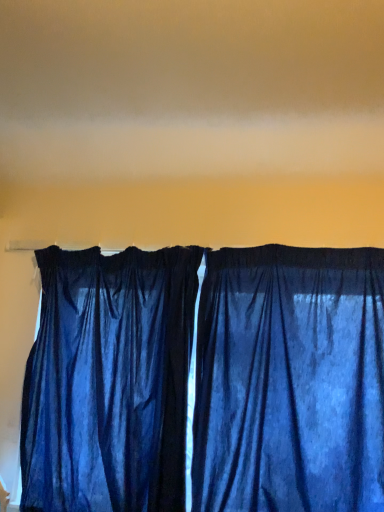
What is the approximate width of velvet blue curtains at center?

velvet blue curtains at center is 2.00 inches wide.

This screenshot has height=512, width=384. What do you see at coordinates (290, 381) in the screenshot? I see `velvet blue curtains at center` at bounding box center [290, 381].

This screenshot has width=384, height=512. Identify the location of velvet blue curtains at center. (290, 381).

Identify the location of velvet blue curtains at center. (290, 381).